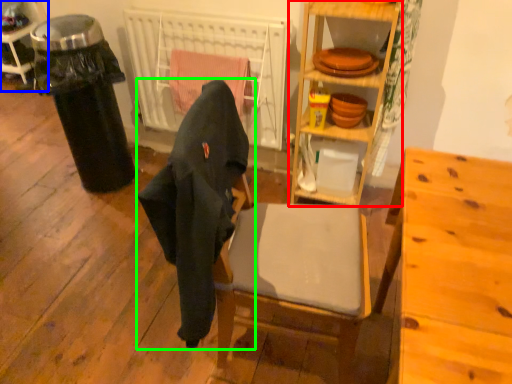
Question: Which object is positioned closest to shelf (highlighted by a red box)? Select from cabinetry (highlighted by a blue box) and chair (highlighted by a green box).

Choices:
 (A) cabinetry
 (B) chair

Answer: (B)